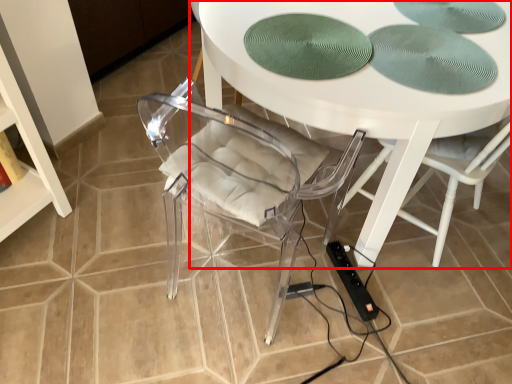
Question: From the image's perspective, where is table (annotated by the red box) located relative to extension cord?

Choices:
 (A) below
 (B) above

Answer: (B)